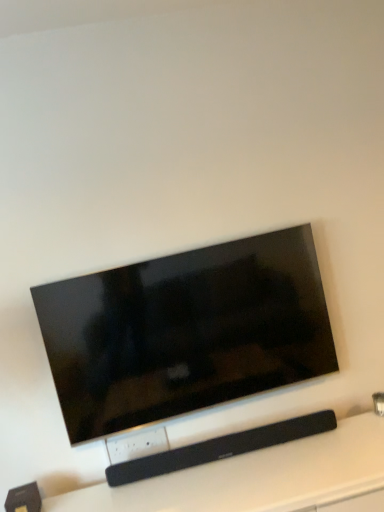
The height and width of the screenshot is (512, 384). Describe the element at coordinates (261, 478) in the screenshot. I see `black matte soundbar at center` at that location.

Based on the photo, measure the distance between black matte soundbar at center and camera.

black matte soundbar at center is 1.46 meters from camera.

The width and height of the screenshot is (384, 512). I want to click on black matte soundbar at center, so 261,478.

Where is `matte black tv at center`? The image size is (384, 512). matte black tv at center is located at coordinates (185, 331).

Based on the photo, in order to face matte black tv at center, should I rotate leftwards or rightwards?

To align with it, rotate left about 0.027°.

Describe the element at coordinates (185, 331) in the screenshot. The height and width of the screenshot is (512, 384). I see `matte black tv at center` at that location.

Locate an element on the screen. The height and width of the screenshot is (512, 384). black matte soundbar at center is located at coordinates (261, 478).

Is matte black tv at center to the left of black matte soundbar at center from the viewer's perspective?

Correct, you'll find matte black tv at center to the left of black matte soundbar at center.

Considering their positions, is matte black tv at center located in front of or behind black matte soundbar at center?

In the image, matte black tv at center appears behind black matte soundbar at center.

Is point (176, 276) less distant than point (240, 477)?

No, (176, 276) is behind (240, 477).

From the image's perspective, is matte black tv at center positioned above or below black matte soundbar at center?

matte black tv at center is above black matte soundbar at center.

From a real-world perspective, is matte black tv at center located higher than black matte soundbar at center?

Yes, from a real-world perspective, matte black tv at center is above black matte soundbar at center.

Does matte black tv at center have a lesser width compared to black matte soundbar at center?

Yes, matte black tv at center is thinner than black matte soundbar at center.

Which of these two, matte black tv at center or black matte soundbar at center, stands shorter?

black matte soundbar at center.

Which of these two, matte black tv at center or black matte soundbar at center, is bigger?

Bigger between the two is black matte soundbar at center.

Can black matte soundbar at center be found inside matte black tv at center?

No.

Is matte black tv at center directly adjacent to black matte soundbar at center?

No, matte black tv at center is not with black matte soundbar at center.

Is matte black tv at center oriented towards black matte soundbar at center?

No, matte black tv at center is not turned towards black matte soundbar at center.

How many degrees apart are the facing directions of matte black tv at center and black matte soundbar at center?

The angular difference between matte black tv at center and black matte soundbar at center is 0.0951 degrees.

The width and height of the screenshot is (384, 512). In order to click on television above the black matte soundbar at center (from a real-world perspective) in this screenshot , I will do `click(185, 331)`.

Which is more to the left, black matte soundbar at center or matte black tv at center?

From the viewer's perspective, matte black tv at center appears more on the left side.

Considering their positions, is black matte soundbar at center located in front of or behind matte black tv at center?

In the image, black matte soundbar at center appears in front of matte black tv at center.

Which is less distant, (x=189, y=474) or (x=156, y=273)?

The point (x=189, y=474) is more forward.

From the image's perspective, between black matte soundbar at center and matte black tv at center, which one is located above?

matte black tv at center, from the image's perspective.

From a real-world perspective, which object rests below the other?

In real-world perspective, black matte soundbar at center is lower.

Which of these two, black matte soundbar at center or matte black tv at center, is wider?

black matte soundbar at center.

Can you confirm if black matte soundbar at center is shorter than matte black tv at center?

Indeed, black matte soundbar at center has a lesser height compared to matte black tv at center.

Looking at this image, between black matte soundbar at center and matte black tv at center, which one has larger size?

Bigger between the two is black matte soundbar at center.

Do you think black matte soundbar at center is within matte black tv at center, or outside of it?

black matte soundbar at center is spatially situated outside matte black tv at center.

Is black matte soundbar at center placed right next to matte black tv at center?

No.

Looking at this image, is black matte soundbar at center facing towards matte black tv at center?

No, black matte soundbar at center is not turned towards matte black tv at center.

Can you tell me how much black matte soundbar at center and matte black tv at center differ in facing direction?

The facing directions of black matte soundbar at center and matte black tv at center are 0.0951 degrees apart.

In the image, there is a black matte soundbar at center. At what (x,y) coordinates should I click in order to perform the action: click on television above it (from the image's perspective). Please return your answer as a coordinate pair (x, y). Looking at the image, I should click on (185, 331).

Where is `furniture in front of the matte black tv at center`? The height and width of the screenshot is (512, 384). furniture in front of the matte black tv at center is located at coordinates (261, 478).

You are a GUI agent. You are given a task and a screenshot of the screen. Output one action in this format:
    pyautogui.click(x=<x>, y=<y>)
    Task: Click on the television above the black matte soundbar at center (from a real-world perspective)
    Image resolution: width=384 pixels, height=512 pixels.
    Given the screenshot: What is the action you would take?
    (185, 331)